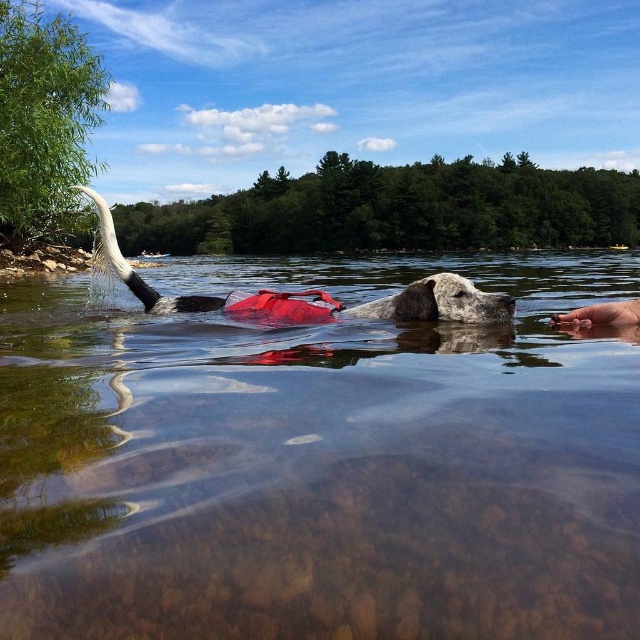
You are a drone operator trying to capture a closeup of the dog in the lake. The drone is currently at the point indicated by point (x=284, y=307). Which direction should you move the drone to get closer to the dog?

The point (x=284, y=307) indicates the red rubber life jacket at center. Since the dog is wearing the life jacket, the drone is already positioned over the dog. No movement is needed.

You are standing on the dock and want to throw a stick to the gray fur dog at center. The stick you have can reach up to 3 meters. Do you think the stick will reach the dog?

The distance between you and the gray fur dog at center is 3.12 meters, which is slightly beyond the 3 meter reach of the stick. Therefore, the stick will not reach the dog.

You are a photographer taking a picture of the dog in the lake. You notice two points marked in the scene. The first point is at coordinates point (x=323, y=307) and the second is at point (x=614, y=312). Which point is closer to your camera?

Point (x=614, y=312) is closer to the camera because the description states that point (x=323, y=307) is further away than point (x=614, y=312).